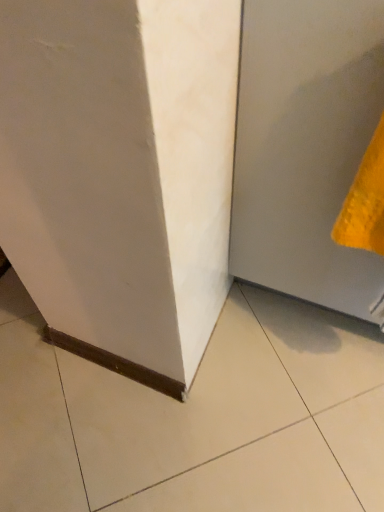
Describe the element at coordinates (365, 201) in the screenshot. I see `yellow textured towel at right` at that location.

Identify the location of yellow textured towel at right. (365, 201).

This screenshot has height=512, width=384. Find the location of `matte gray door at lower right`. matte gray door at lower right is located at coordinates (305, 146).

Image resolution: width=384 pixels, height=512 pixels. Describe the element at coordinates (305, 146) in the screenshot. I see `matte gray door at lower right` at that location.

The width and height of the screenshot is (384, 512). I want to click on yellow textured towel at right, so click(365, 201).

Considering the relative positions of matte gray door at lower right and yellow textured towel at right in the image provided, is matte gray door at lower right to the left of yellow textured towel at right from the viewer's perspective?

In fact, matte gray door at lower right is to the right of yellow textured towel at right.

Is matte gray door at lower right behind yellow textured towel at right?

No, matte gray door at lower right is closer to the viewer.

Does point (282, 163) come in front of point (348, 225)?

No, (282, 163) is further to viewer.

From the image's perspective, which one is positioned higher, matte gray door at lower right or yellow textured towel at right?

From the image's view, matte gray door at lower right is above.

From a real-world perspective, which object rests below the other?

matte gray door at lower right, from a real-world perspective.

From the picture: Between matte gray door at lower right and yellow textured towel at right, which one has smaller width?

yellow textured towel at right is thinner.

In the scene shown: Considering the sizes of objects matte gray door at lower right and yellow textured towel at right in the image provided, who is taller, matte gray door at lower right or yellow textured towel at right?

Standing taller between the two is matte gray door at lower right.

Considering the relative sizes of matte gray door at lower right and yellow textured towel at right in the image provided, is matte gray door at lower right smaller than yellow textured towel at right?

No.

Would you say matte gray door at lower right is inside or outside yellow textured towel at right?

matte gray door at lower right exists outside the volume of yellow textured towel at right.

Are matte gray door at lower right and yellow textured towel at right beside each other?

No, matte gray door at lower right is not touching yellow textured towel at right.

Is matte gray door at lower right turned away from yellow textured towel at right?

No, matte gray door at lower right is not facing the opposite direction of yellow textured towel at right.

You are a GUI agent. You are given a task and a screenshot of the screen. Output one action in this format:
    pyautogui.click(x=<x>, y=<y>)
    Task: Click on the hand towel above the matte gray door at lower right (from a real-world perspective)
    This screenshot has width=384, height=512.
    Given the screenshot: What is the action you would take?
    pyautogui.click(x=365, y=201)

Considering the positions of objects yellow textured towel at right and matte gray door at lower right in the image provided, who is more to the left, yellow textured towel at right or matte gray door at lower right?

yellow textured towel at right is more to the left.

Relative to matte gray door at lower right, is yellow textured towel at right in front or behind?

In the image, yellow textured towel at right appears behind matte gray door at lower right.

Is point (382, 229) positioned in front of point (329, 210)?

Yes, it is.

From the picture: From the image's perspective, is yellow textured towel at right positioned above or below matte gray door at lower right?

yellow textured towel at right is situated lower than matte gray door at lower right in the image.

From a real-world perspective, which object rests below the other?

From a 3D spatial view, matte gray door at lower right is below.

Looking at their sizes, would you say yellow textured towel at right is wider or thinner than matte gray door at lower right?

yellow textured towel at right is thinner than matte gray door at lower right.

From their relative heights in the image, would you say yellow textured towel at right is taller or shorter than matte gray door at lower right?

Considering their sizes, yellow textured towel at right has less height than matte gray door at lower right.

Considering the relative sizes of yellow textured towel at right and matte gray door at lower right in the image provided, is yellow textured towel at right bigger than matte gray door at lower right?

Actually, yellow textured towel at right might be smaller than matte gray door at lower right.

Would you say yellow textured towel at right is inside or outside matte gray door at lower right?

yellow textured towel at right can be found inside matte gray door at lower right.

Would you consider yellow textured towel at right to be distant from matte gray door at lower right?

No, yellow textured towel at right is in close proximity to matte gray door at lower right.

Could you tell me if yellow textured towel at right is facing matte gray door at lower right?

No, yellow textured towel at right does not turn towards matte gray door at lower right.

How different are the orientations of yellow textured towel at right and matte gray door at lower right in degrees?

0.000925 degrees separate the facing orientations of yellow textured towel at right and matte gray door at lower right.

Where is `hand towel on the left of matte gray door at lower right`? The image size is (384, 512). hand towel on the left of matte gray door at lower right is located at coordinates (365, 201).

Image resolution: width=384 pixels, height=512 pixels. What are the coordinates of `door above the yellow textured towel at right (from the image's perspective)` in the screenshot? It's located at pyautogui.click(x=305, y=146).

Locate an element on the screen. The height and width of the screenshot is (512, 384). hand towel above the matte gray door at lower right (from a real-world perspective) is located at coordinates (365, 201).